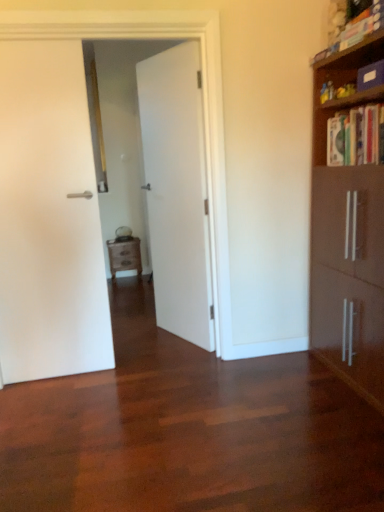
Question: From a real-world perspective, is hardcover book at upper right, which is the second book from bottom to top, positioned above or below white matte door at center, placed as the 1th door when sorted from right to left?

Choices:
 (A) below
 (B) above

Answer: (B)

Question: Is hardcover book at upper right, the 1th book viewed from the top, to the left or to the right of white matte door at center, the 2th door positioned from the left, in the image?

Choices:
 (A) right
 (B) left

Answer: (A)

Question: Which of these objects is positioned closest to the wooden nightstand at center?

Choices:
 (A) white matte door at center, placed as the 1th door when sorted from right to left
 (B) hardcover book at upper right, the 1th book viewed from the top
 (C) white matte door at left, which appears as the second door when viewed from the right
 (D) hardcover book at upper right, arranged as the second book when viewed from the top

Answer: (A)

Question: Which object is the closest to the hardcover book at upper right, the 1th book viewed from the top?

Choices:
 (A) white matte door at center, the 2th door positioned from the left
 (B) wooden nightstand at center
 (C) hardcover book at upper right, the first book positioned from the bottom
 (D) white matte door at left, arranged as the first door when viewed from the left

Answer: (C)